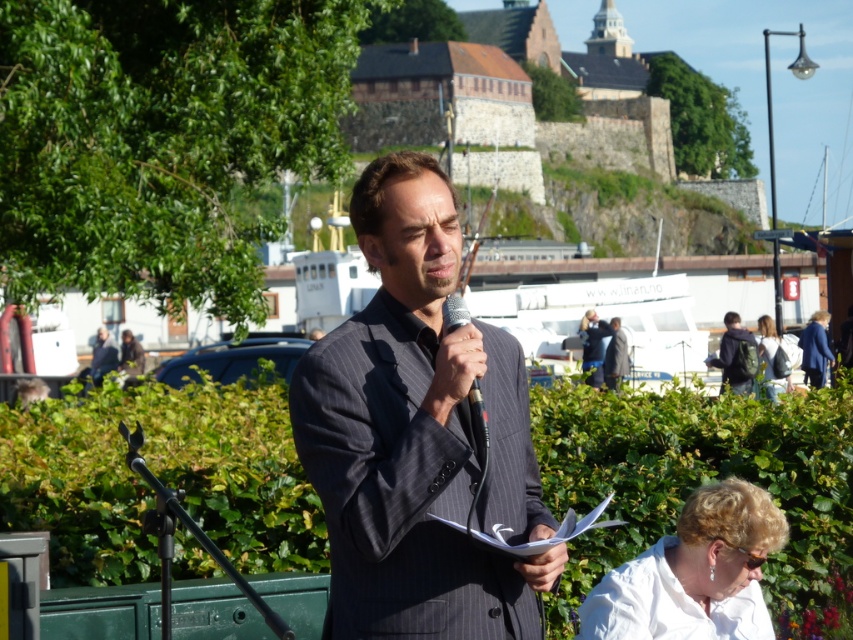
You are a photographer trying to capture a clear shot of the white fabric at lower right and the dark green backpack at right. Which object will appear taller in your photo?

The dark green backpack at right is taller than the white fabric at lower right, so it will appear taller in the photo.

You are organizing a small event and need to place a decorative stand between the dark green backpack at right and the metallic silver microphone at center. Considering their sizes, which object should be placed closer to the stand to ensure it fits properly?

The dark green backpack at right might be wider than the metallic silver microphone at center, so placing the backpack closer to the stand would allow the microphone to fit within the available space.

You are a photographer trying to capture the central speaker while ensuring both the white fabric at lower right and the dark green backpack at right are visible in the frame. Which object should you focus on first to ensure depth of field captures both?

The white fabric at lower right is closer to the viewer than the dark green backpack at right, so focus on the white fabric at lower right first to ensure both are in focus.